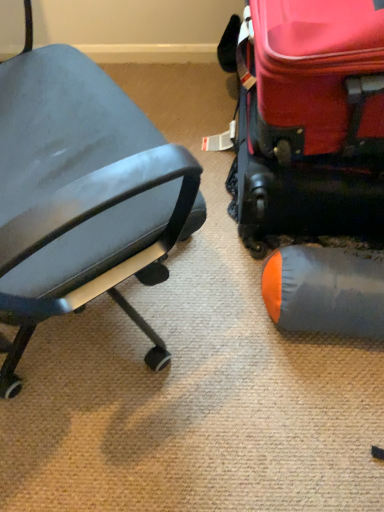
Describe the element at coordinates (309, 120) in the screenshot. This screenshot has height=512, width=384. I see `rubberized red suitcase at right` at that location.

What is the approximate width of rubberized red suitcase at right?

The width of rubberized red suitcase at right is 21.53 inches.

Identify the location of rubberized red suitcase at right. Image resolution: width=384 pixels, height=512 pixels. (309, 120).

Image resolution: width=384 pixels, height=512 pixels. I want to click on rubberized red suitcase at right, so click(x=309, y=120).